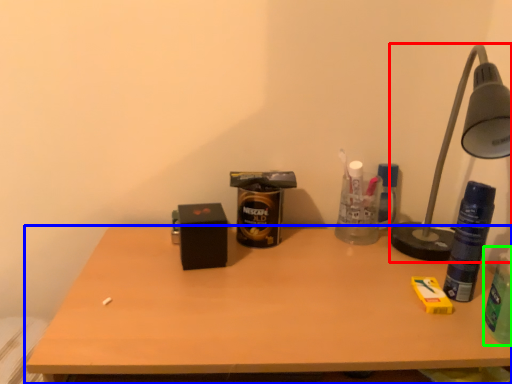
Question: Which object is positioned closest to lamp (highlighted by a red box)? Select from desk (highlighted by a blue box) and beverage (highlighted by a green box).

Choices:
 (A) desk
 (B) beverage

Answer: (B)